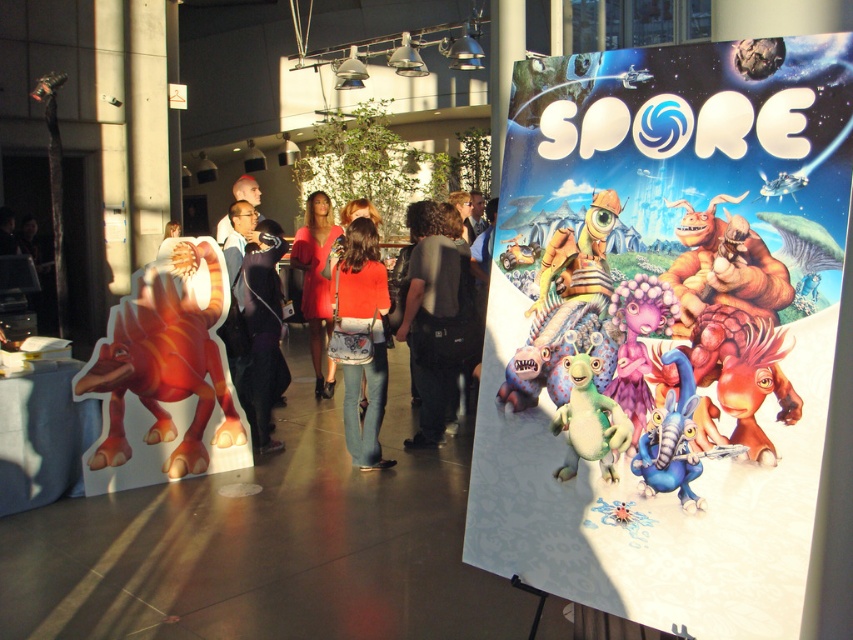
Can you confirm if orange fabric dress at center is positioned below matte red dress at center?

Correct, orange fabric dress at center is located below matte red dress at center.

Is point (427, 212) behind point (302, 227)?

No.

I want to click on orange fabric dress at center, so click(x=364, y=273).

Does orange fabric dress at center come behind fuzzy brown creature at right?

That is True.

This screenshot has width=853, height=640. What do you see at coordinates (364, 273) in the screenshot? I see `orange fabric dress at center` at bounding box center [364, 273].

Between point (442, 406) and point (757, 435), which one is positioned behind?

The point (442, 406) is more distant.

The image size is (853, 640). What are the coordinates of `orange fabric dress at center` in the screenshot? It's located at (364, 273).

Consider the image. Between dark gray fabric backpack at center and purple matte alien at center, which one is positioned higher?

dark gray fabric backpack at center

Which is in front, point (419, 225) or point (659, 305)?

Point (659, 305) is more forward.

This screenshot has width=853, height=640. Identify the location of dark gray fabric backpack at center. (431, 317).